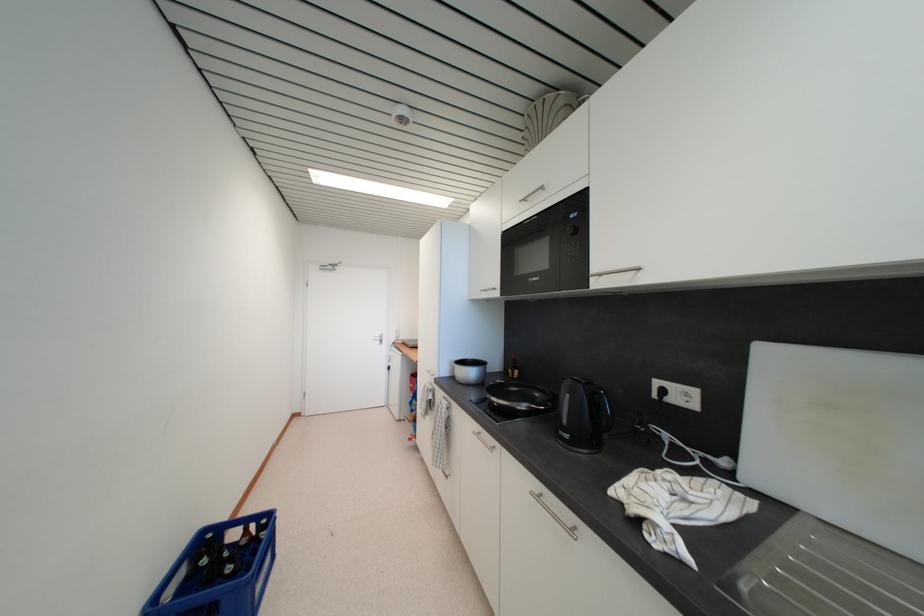
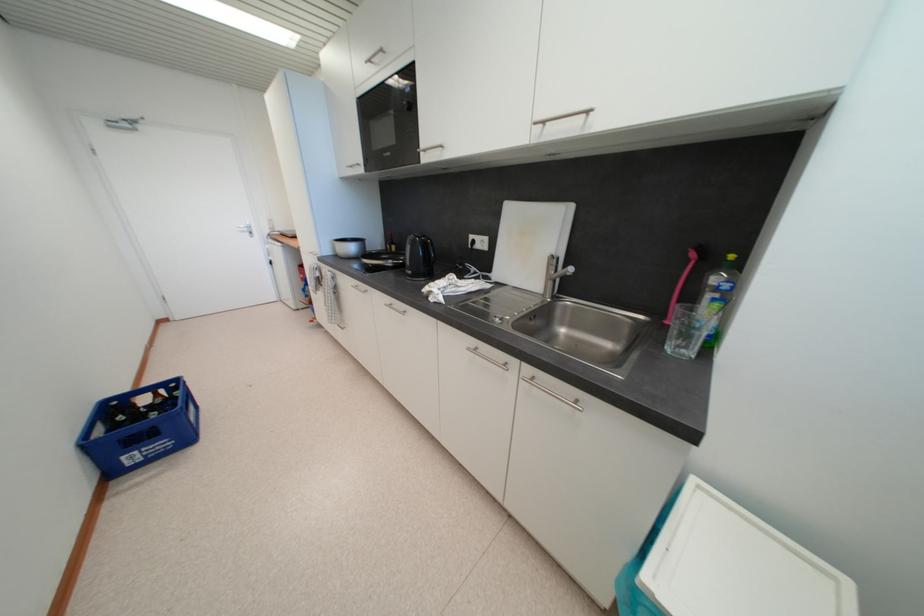
In the second image, find the point that corresponds to the point at 381,342 in the first image.

(248, 235)